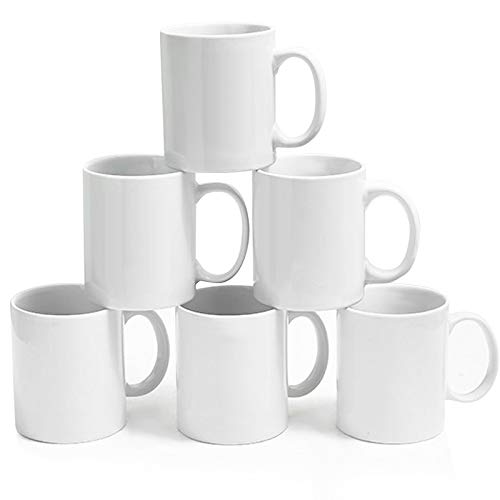
Find the location of a particular element. The height and width of the screenshot is (500, 500). white coffee mug is located at coordinates (352, 384), (266, 365), (68, 385), (307, 228), (127, 235), (215, 96).